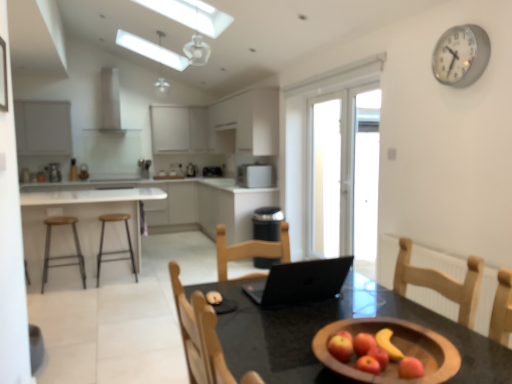
Question: Considering the relative positions of white matte exhaust hood at upper center and white matte cabinet at upper center, the 2th cabinetry from the right, in the image provided, is white matte exhaust hood at upper center behind white matte cabinet at upper center, the 2th cabinetry from the right,?

Choices:
 (A) yes
 (B) no

Answer: (A)

Question: Is white matte exhaust hood at upper center outside white matte cabinet at upper center, the 2th cabinetry from the right?

Choices:
 (A) no
 (B) yes

Answer: (B)

Question: Can white matte cabinet at upper center, the 4th cabinetry in the left-to-right sequence, be found inside white matte exhaust hood at upper center?

Choices:
 (A) yes
 (B) no

Answer: (B)

Question: Are white matte exhaust hood at upper center and white matte cabinet at upper center, the 2th cabinetry from the right, located far from each other?

Choices:
 (A) no
 (B) yes

Answer: (B)

Question: From the image's perspective, is white matte exhaust hood at upper center below white matte cabinet at upper center, the 2th cabinetry from the right?

Choices:
 (A) yes
 (B) no

Answer: (B)

Question: In terms of width, does matte white cabinet at left, the first cabinetry viewed from the left, look wider or thinner when compared to transparent glass door at center?

Choices:
 (A) thin
 (B) wide

Answer: (B)

Question: Would you say matte white cabinet at left, the first cabinetry viewed from the left, is to the left or to the right of transparent glass door at center in the picture?

Choices:
 (A) left
 (B) right

Answer: (A)

Question: Is matte white cabinet at left, which appears as the 5th cabinetry when viewed from the right, in front of or behind transparent glass door at center in the image?

Choices:
 (A) front
 (B) behind

Answer: (B)

Question: Is matte white cabinet at left, which appears as the 5th cabinetry when viewed from the right, inside or outside of transparent glass door at center?

Choices:
 (A) inside
 (B) outside

Answer: (B)

Question: Choose the correct answer: Is white matte cabinet at upper center, the 3th cabinetry viewed from the right, inside transparent glass door at center or outside it?

Choices:
 (A) inside
 (B) outside

Answer: (B)

Question: Is white matte cabinet at upper center, which appears as the third cabinetry when viewed from the left, in front of or behind transparent glass door at center in the image?

Choices:
 (A) front
 (B) behind

Answer: (B)

Question: Is white matte cabinet at upper center, the 3th cabinetry viewed from the right, bigger or smaller than transparent glass door at center?

Choices:
 (A) big
 (B) small

Answer: (A)

Question: Is white matte cabinet at upper center, which appears as the third cabinetry when viewed from the left, taller or shorter than transparent glass door at center?

Choices:
 (A) short
 (B) tall

Answer: (A)

Question: Based on their sizes in the image, would you say white matte exhaust hood at upper center is bigger or smaller than satin silver toaster at center, which is counted as the 1th appliance, starting from the back?

Choices:
 (A) big
 (B) small

Answer: (A)

Question: Is white matte exhaust hood at upper center to the left or to the right of satin silver toaster at center, which appears as the second appliance when viewed from the right, in the image?

Choices:
 (A) left
 (B) right

Answer: (A)